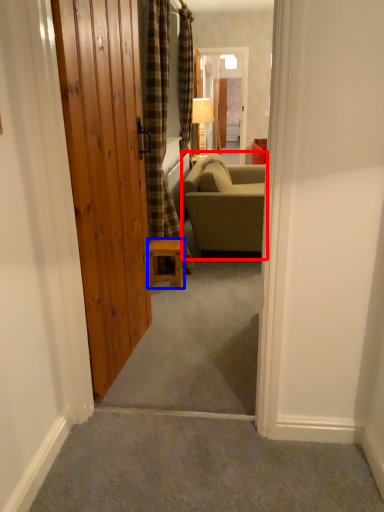
Question: Which point is closer to the camera, studio couch (highlighted by a red box) or furniture (highlighted by a blue box)?

Choices:
 (A) studio couch
 (B) furniture

Answer: (B)